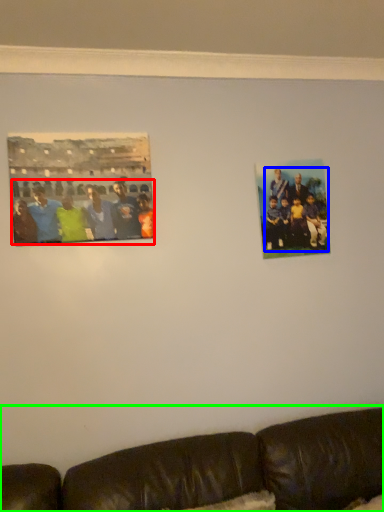
Question: Based on their relative distances, which object is farther from person (highlighted by a red box)? Choose from person (highlighted by a blue box) and studio couch (highlighted by a green box).

Choices:
 (A) person
 (B) studio couch

Answer: (B)